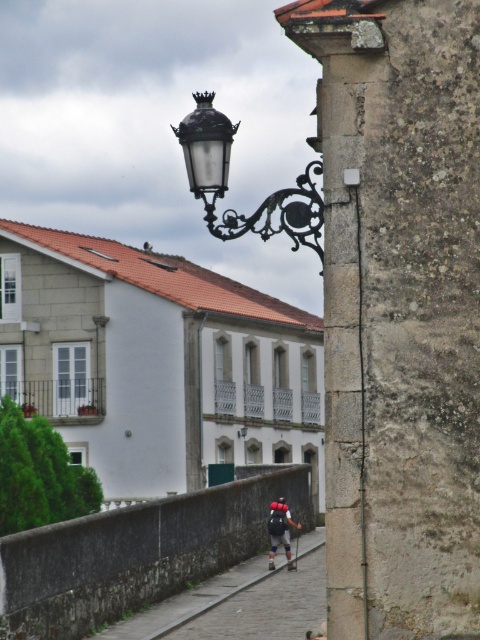
Question: Does black wrought iron streetlight at upper center come in front of matte black backpack at center?

Choices:
 (A) yes
 (B) no

Answer: (A)

Question: Which point is farther to the camera?

Choices:
 (A) (298, 204)
 (B) (208, 300)
 (C) (273, 536)

Answer: (B)

Question: Based on their relative distances, which object is nearer to the black wrought iron streetlight at upper center?

Choices:
 (A) white stone building at upper left
 (B) matte black backpack at center

Answer: (B)

Question: Is black wrought iron streetlight at upper center closer to camera compared to matte black backpack at center?

Choices:
 (A) yes
 (B) no

Answer: (A)

Question: Which point is farther from the camera taking this photo?

Choices:
 (A) (109, 474)
 (B) (204, 106)

Answer: (A)

Question: Is the position of black wrought iron streetlight at upper center less distant than that of matte black backpack at center?

Choices:
 (A) no
 (B) yes

Answer: (B)